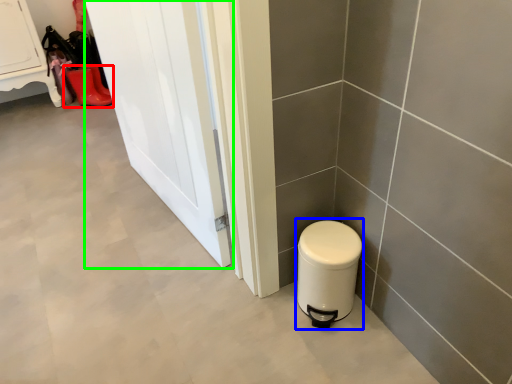
Question: Considering the real-world distances, which object is closest to footwear (highlighted by a red box)? water heater (highlighted by a blue box) or door (highlighted by a green box).

Choices:
 (A) water heater
 (B) door

Answer: (B)